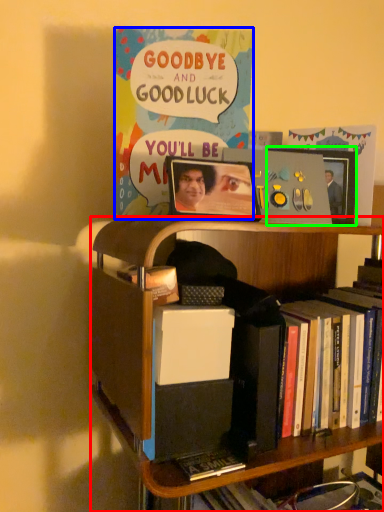
Question: Which object is positioned closest to bookcase (highlighted by a red box)? Select from comic book (highlighted by a blue box) and picture frame (highlighted by a green box).

Choices:
 (A) comic book
 (B) picture frame

Answer: (A)